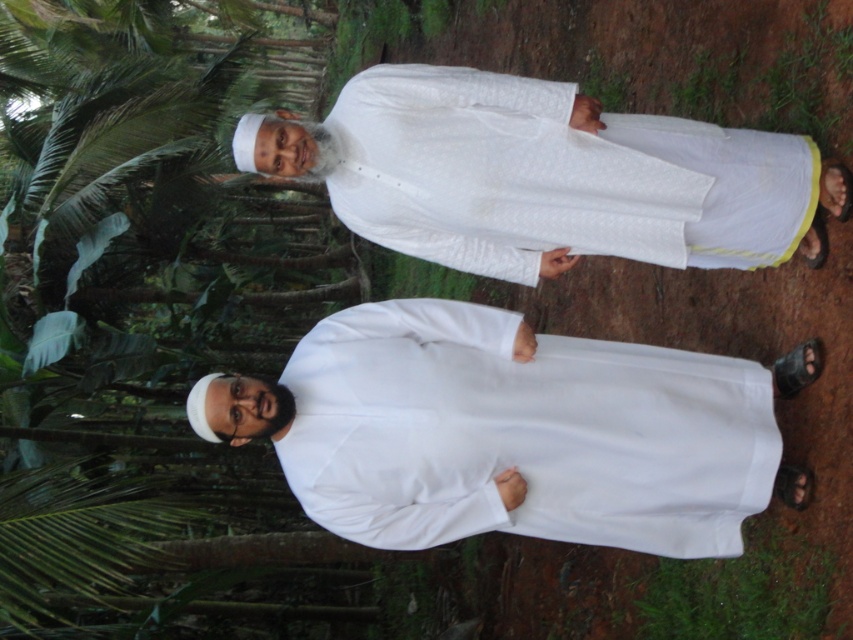
Which is in front, point (428, 461) or point (799, 134)?

Point (428, 461)

Find the location of a particular element. white matte/soft fabric at center is located at coordinates (509, 432).

At what (x,y) coordinates should I click in order to perform the action: click on white matte/soft fabric at center. Please return your answer as a coordinate pair (x, y). The height and width of the screenshot is (640, 853). Looking at the image, I should click on (509, 432).